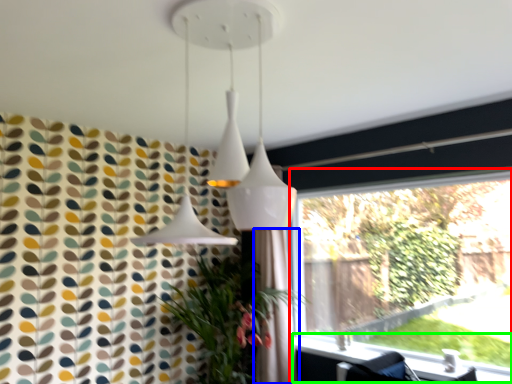
Question: Estimate the real-world distances between objects in this image. Which object is farther from window (highlighted by a red box), shower curtain (highlighted by a blue box) or window sill (highlighted by a green box)?

Choices:
 (A) shower curtain
 (B) window sill

Answer: (A)